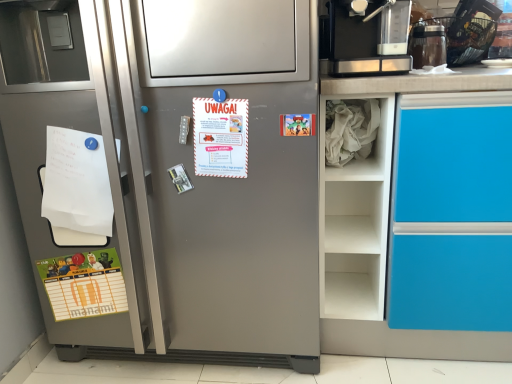
Question: Does white paper at center, which is the 2th postcard in bottom-to-top order, appear on the left side of satin silver refrigerator at left?

Choices:
 (A) yes
 (B) no

Answer: (B)

Question: Is white paper at center, the 2th postcard positioned from the right, smaller than satin silver refrigerator at left?

Choices:
 (A) yes
 (B) no

Answer: (A)

Question: Is satin silver refrigerator at left surrounded by white paper at center, the 1th postcard viewed from the front?

Choices:
 (A) yes
 (B) no

Answer: (B)

Question: Considering the relative sizes of white paper at center, the third postcard positioned from the back, and satin silver refrigerator at left in the image provided, is white paper at center, the third postcard positioned from the back, shorter than satin silver refrigerator at left?

Choices:
 (A) no
 (B) yes

Answer: (B)

Question: Would you consider white paper at center, the third postcard positioned from the back, to be distant from satin silver refrigerator at left?

Choices:
 (A) no
 (B) yes

Answer: (A)

Question: Based on their sizes in the image, would you say transparent plastic container at upper right, the first appliance viewed from the left, is bigger or smaller than white paper at center, which is the 2th postcard in bottom-to-top order?

Choices:
 (A) small
 (B) big

Answer: (B)

Question: Is transparent plastic container at upper right, the first appliance viewed from the left, inside or outside of white paper at center, which is the 2th postcard in bottom-to-top order?

Choices:
 (A) inside
 (B) outside

Answer: (B)

Question: Does point (442, 46) appear closer or farther from the camera than point (194, 158)?

Choices:
 (A) farther
 (B) closer

Answer: (A)

Question: From the image's perspective, is transparent plastic container at upper right, the first appliance viewed from the left, positioned above or below white paper at center, arranged as the 2th postcard when viewed from the left?

Choices:
 (A) below
 (B) above

Answer: (B)

Question: Considering the positions of point (x=83, y=220) and point (x=296, y=130), is point (x=83, y=220) closer or farther from the camera than point (x=296, y=130)?

Choices:
 (A) closer
 (B) farther

Answer: (B)

Question: Is white paper at left in front of or behind cartoon paper at upper right, which appears as the 3th postcard when ordered from the bottom, in the image?

Choices:
 (A) front
 (B) behind

Answer: (B)

Question: Considering the positions of white paper at left and cartoon paper at upper right, the first postcard positioned from the right, in the image, is white paper at left wider or thinner than cartoon paper at upper right, the first postcard positioned from the right,?

Choices:
 (A) thin
 (B) wide

Answer: (B)

Question: In terms of size, does white paper at left appear bigger or smaller than cartoon paper at upper right, the 2th postcard viewed from the back?

Choices:
 (A) small
 (B) big

Answer: (B)

Question: Looking at their shapes, would you say satin silver refrigerator at left is wider or thinner than white crumpled paper at right?

Choices:
 (A) thin
 (B) wide

Answer: (B)

Question: Visually, is satin silver refrigerator at left positioned to the left or to the right of white crumpled paper at right?

Choices:
 (A) left
 (B) right

Answer: (A)